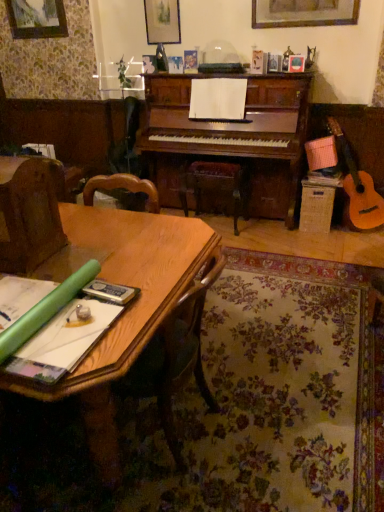
What do you see at coordinates (126, 309) in the screenshot? The image size is (384, 512). I see `wooden table at lower left` at bounding box center [126, 309].

Describe the element at coordinates (37, 19) in the screenshot. I see `wooden picture frame at upper left` at that location.

The width and height of the screenshot is (384, 512). I want to click on wooden table at lower left, so click(x=126, y=309).

From a real-world perspective, is wooden picture frame at upper left positioned above or below wooden table at lower left?

wooden picture frame at upper left is situated higher than wooden table at lower left in the real world.

At what (x,y) coordinates should I click in order to perform the action: click on picture frame above the wooden table at lower left (from a real-world perspective). Please return your answer as a coordinate pair (x, y). This screenshot has height=512, width=384. Looking at the image, I should click on (37, 19).

Does point (43, 2) come behind point (125, 367)?

Yes, it is.

Who is shorter, wooden picture frame at upper left or wooden table at lower left?

wooden picture frame at upper left is shorter.

From a real-world perspective, between wooden table at lower left and brown fabric armchair at left, who is vertically lower?

In real-world perspective, wooden table at lower left is lower.

Is wooden table at lower left facing towards brown fabric armchair at left?

No, wooden table at lower left is not turned towards brown fabric armchair at left.

Between wooden table at lower left and brown fabric armchair at left, which one has larger size?

Bigger between the two is wooden table at lower left.

Considering the relative sizes of wooden at center and brown fabric armchair at left in the image provided, is wooden at center taller than brown fabric armchair at left?

Indeed, wooden at center has a greater height compared to brown fabric armchair at left.

Which is in front, point (236, 204) or point (52, 215)?

The point (52, 215) is in front.

Could you tell me if wooden at center is facing brown fabric armchair at left?

Yes, wooden at center is aimed at brown fabric armchair at left.

Would you say wooden at center contains green paper at lower left?

Definitely not — green paper at lower left is not inside wooden at center.

How many degrees apart are the facing directions of wooden at center and green paper at lower left?

The angular difference between wooden at center and green paper at lower left is 92.2 degrees.

At what (x,y) coordinates should I click in order to perform the action: click on music stool behind the green paper at lower left. Please return your answer as a coordinate pair (x, y). This screenshot has width=384, height=512. Looking at the image, I should click on (215, 184).

Can you confirm if wooden at center is thinner than green paper at lower left?

Correct, the width of wooden at center is less than that of green paper at lower left.

Is brown fabric armchair at left not within green paper at lower left?

Indeed, brown fabric armchair at left is completely outside green paper at lower left.

In the scene shown: From a real-world perspective, is brown fabric armchair at left located beneath green paper at lower left?

No, from a real-world perspective, brown fabric armchair at left is not below green paper at lower left.

This screenshot has width=384, height=512. Identify the location of book below the brown fabric armchair at left (from the image's perspective). (63, 341).

In the scene shown: Is wooden at center located within green paper at lower left?

Definitely not — wooden at center is not inside green paper at lower left.

Can you confirm if green paper at lower left is shorter than wooden at center?

Indeed, green paper at lower left has a lesser height compared to wooden at center.

Is green paper at lower left oriented towards wooden at center?

No, green paper at lower left is not aimed at wooden at center.

From a real-world perspective, which is physically above, green paper at lower left or wooden at center?

From a 3D spatial view, green paper at lower left is above.

Considering the sizes of objects wooden table at lower left and green paper at lower left in the image provided, who is taller, wooden table at lower left or green paper at lower left?

Standing taller between the two is wooden table at lower left.

Could you tell me if wooden table at lower left is turned towards green paper at lower left?

No, wooden table at lower left is not aimed at green paper at lower left.

From the image's perspective, which one is positioned higher, wooden table at lower left or green paper at lower left?

green paper at lower left is shown above in the image.

Is wooden table at lower left in front of green paper at lower left?

Yes.

The image size is (384, 512). I want to click on table that appears in front of the wooden picture frame at upper left, so click(126, 309).

Locate an element on the screen. The image size is (384, 512). table below the brown fabric armchair at left (from a real-world perspective) is located at coordinates (126, 309).

When comparing their distances from brown fabric armchair at left, does wooden at center or wooden table at lower left seem closer?

Among the two, wooden table at lower left is located nearer to brown fabric armchair at left.

When comparing their distances from wooden picture frame at upper left, does green paper at lower left or wooden table at lower left seem closer?

Based on the image, wooden table at lower left appears to be nearer to wooden picture frame at upper left.

Which object lies further to the anchor point wooden table at lower left, wooden picture frame at upper left or wooden at center?

wooden picture frame at upper left.

From the image, which object appears to be farther from wooden picture frame at upper left, wooden at center or wooden table at lower left?

Based on the image, wooden table at lower left appears to be further to wooden picture frame at upper left.

Estimate the real-world distances between objects in this image. Which object is closer to green paper at lower left, brown fabric armchair at left or wooden picture frame at upper left?

brown fabric armchair at left is closer to green paper at lower left.

Which object lies nearer to the anchor point wooden picture frame at upper left, green paper at lower left or wooden at center?

wooden at center is positioned closer to the anchor wooden picture frame at upper left.

From the image, which object appears to be farther from wooden at center, wooden picture frame at upper left or brown fabric armchair at left?

brown fabric armchair at left lies further to wooden at center than the other object.

Considering their positions, is wooden table at lower left positioned further to brown fabric armchair at left than green paper at lower left?

Among the two, green paper at lower left is located further to brown fabric armchair at left.

Locate an element on the screen. This screenshot has height=512, width=384. music stool between green paper at lower left and wooden picture frame at upper left in the front-back direction is located at coordinates (215, 184).

The image size is (384, 512). Identify the location of music stool located between wooden table at lower left and wooden picture frame at upper left in the depth direction. (215, 184).

I want to click on book between brown fabric armchair at left and wooden table at lower left in the up-down direction, so [x=63, y=341].

I want to click on armchair positioned between wooden table at lower left and wooden picture frame at upper left from near to far, so click(x=29, y=217).